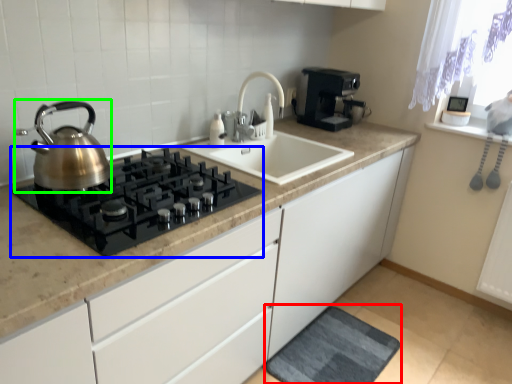
Question: Which is nearer to the bath mat (highlighted by a red box)? gas stove (highlighted by a blue box) or kettle (highlighted by a green box).

Choices:
 (A) gas stove
 (B) kettle

Answer: (A)